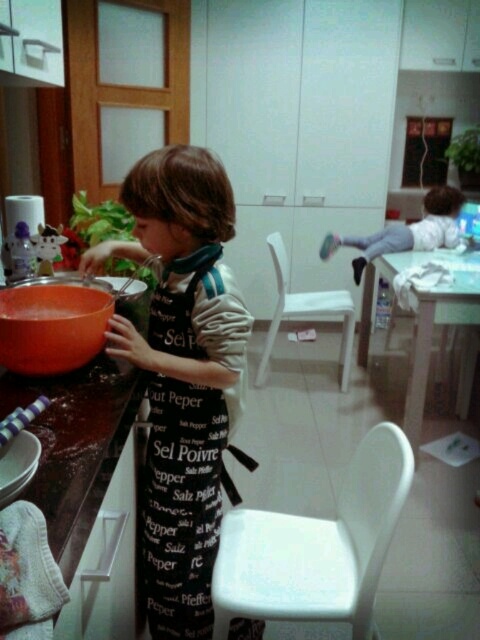
Is black printed apron at center wider than white glossy table at lower right?

No, black printed apron at center is not wider than white glossy table at lower right.

This screenshot has width=480, height=640. Describe the element at coordinates (180, 506) in the screenshot. I see `black printed apron at center` at that location.

You are a GUI agent. You are given a task and a screenshot of the screen. Output one action in this format:
    pyautogui.click(x=<x>, y=<y>)
    Task: Click on the black printed apron at center
    The image size is (480, 640).
    Given the screenshot: What is the action you would take?
    pyautogui.click(x=180, y=506)

Who is positioned more to the right, black printed apron at center or light gray fabric pants at center?

Positioned to the right is light gray fabric pants at center.

Who is more forward, (178, 616) or (419, 241)?

Positioned in front is point (178, 616).

This screenshot has width=480, height=640. What do you see at coordinates (180, 506) in the screenshot? I see `black printed apron at center` at bounding box center [180, 506].

Identify the location of black printed apron at center. point(180,506).

Does point (7, 326) come farther from viewer compared to point (468, 385)?

No, (7, 326) is in front of (468, 385).

Is matte orange bowl at left wider than white glossy table at lower right?

No, matte orange bowl at left is not wider than white glossy table at lower right.

Is point (22, 340) in front of point (462, 285)?

Yes, point (22, 340) is closer to viewer.

Locate an element on the screen. This screenshot has height=640, width=480. matte orange bowl at left is located at coordinates (51, 326).